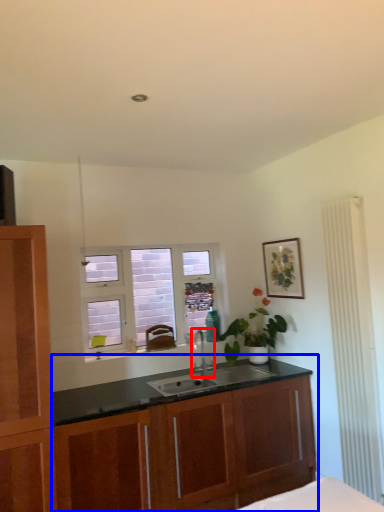
Question: Among these objects, which one is farthest to the camera, tap (highlighted by a red box) or cabinetry (highlighted by a blue box)?

Choices:
 (A) tap
 (B) cabinetry

Answer: (A)